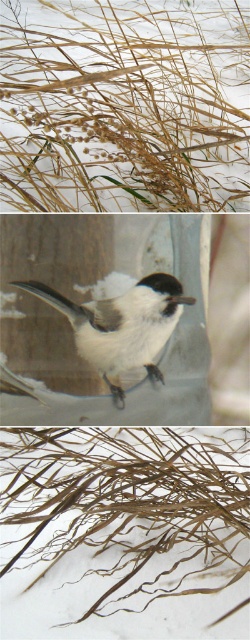
Looking at the collage, you notice the golden straw grass at upper center and the brown dry reed at lower center. Which of these two objects is positioned to the left of the other?

The golden straw grass at upper center is to the left of the brown dry reed at lower center.

In the scene shown: You are a photographer trying to capture a closeup shot of the golden straw grass at upper center and the white matte bird at center. If your camera can focus on objects within 1 meter, will both be in focus?

The golden straw grass at upper center is 90.86 centimeters away from the white matte bird at center. Since both are within 1 meter of the camera, they will both be in focus.

You are an ornithologist observing the middle image of the collage. You need to determine if the golden straw grass at upper center is wider than the white matte bird at center. Based on the scene, what can you conclude?

The golden straw grass at upper center is wider than the white matte bird at center according to the description.